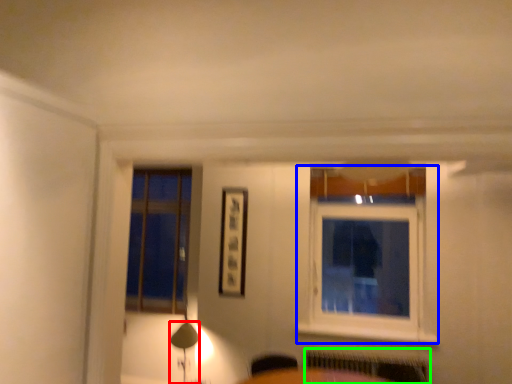
Question: Which object is the closest to the table lamp (highlighted by a red box)? Choose among these: window (highlighted by a blue box) or radiator (highlighted by a green box).

Choices:
 (A) window
 (B) radiator

Answer: (B)